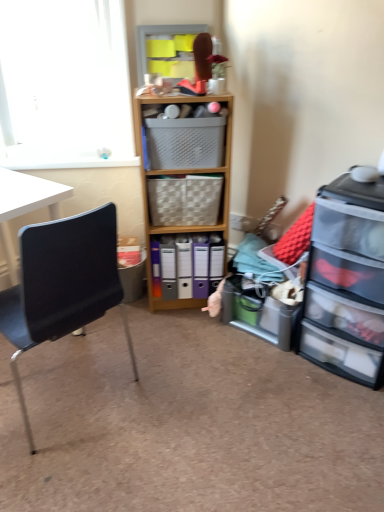
Question: From a real-world perspective, is matte plastic storage box at lower left located beneath matte plastic shelf at upper center, arranged as the second shelf when viewed from the right?

Choices:
 (A) no
 (B) yes

Answer: (B)

Question: Considering the relative positions of matte plastic storage box at lower left and matte plastic shelf at upper center, arranged as the second shelf when viewed from the right, in the image provided, is matte plastic storage box at lower left to the right of matte plastic shelf at upper center, arranged as the second shelf when viewed from the right, from the viewer's perspective?

Choices:
 (A) yes
 (B) no

Answer: (B)

Question: Is matte plastic shelf at upper center, the 1th shelf viewed from the left, a part of matte plastic storage box at lower left?

Choices:
 (A) yes
 (B) no

Answer: (B)

Question: Can you confirm if matte plastic storage box at lower left is positioned to the left of matte plastic shelf at upper center, arranged as the second shelf when viewed from the right?

Choices:
 (A) no
 (B) yes

Answer: (B)

Question: From the image's perspective, would you say matte plastic storage box at lower left is shown under matte plastic shelf at upper center, placed as the 1th shelf when sorted from top to bottom?

Choices:
 (A) no
 (B) yes

Answer: (B)

Question: Is matte plastic storage box at lower left taller than matte plastic shelf at upper center, marked as the second shelf in a bottom-to-top arrangement?

Choices:
 (A) no
 (B) yes

Answer: (A)

Question: Considering the relative sizes of matte plastic storage box at lower left and translucent plastic storage at lower right, positioned as the 1th shelf in bottom-to-top order, in the image provided, is matte plastic storage box at lower left thinner than translucent plastic storage at lower right, positioned as the 1th shelf in bottom-to-top order,?

Choices:
 (A) yes
 (B) no

Answer: (A)

Question: Is matte plastic storage box at lower left far away from translucent plastic storage at lower right, which is the second shelf from top to bottom?

Choices:
 (A) yes
 (B) no

Answer: (B)

Question: Does matte plastic storage box at lower left lie in front of translucent plastic storage at lower right, the 2th shelf positioned from the left?

Choices:
 (A) no
 (B) yes

Answer: (A)

Question: From the image's perspective, is matte plastic storage box at lower left below translucent plastic storage at lower right, positioned as the 1th shelf in bottom-to-top order?

Choices:
 (A) no
 (B) yes

Answer: (A)

Question: Is matte plastic storage box at lower left wider than translucent plastic storage at lower right, which is the second shelf from top to bottom?

Choices:
 (A) no
 (B) yes

Answer: (A)

Question: Is translucent plastic storage at lower right, the 2th shelf positioned from the left, surrounded by matte plastic storage box at lower left?

Choices:
 (A) yes
 (B) no

Answer: (B)

Question: Are clear plastic drawers at right and translucent plastic storage at lower right, the 2th shelf positioned from the left, making contact?

Choices:
 (A) no
 (B) yes

Answer: (A)